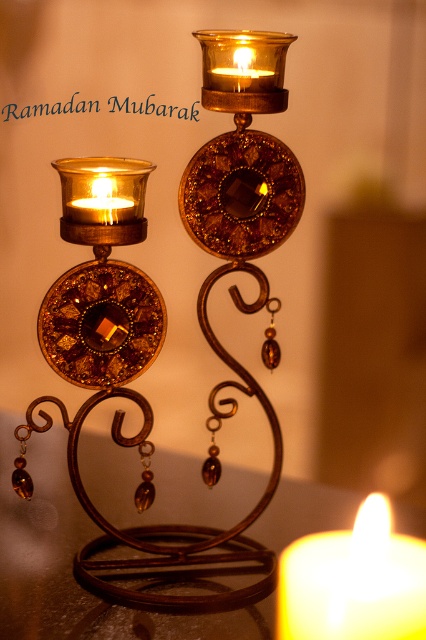
You are trying to place a decorative gold metallic candle holder at center on top of the metallic brown table at center. Based on the scene description, will the candle holder fit on the table without touching the ceiling?

The gold metallic candle holder at center has a greater height compared to metallic brown table at center. Since the candle holder is taller than the table, placing it on the table would cause the top of the candle holder to touch or exceed the table height, potentially making it unstable or too close to the ceiling. Therefore, it might not fit properly without adjustments.

You are arranging flowers for a centerpiece and need to place them between the matte gold candle at upper center and the matte gold candle at left. Which candle should you place the flowers closer to based on their positions?

The matte gold candle at upper center is to the right of the matte gold candle at left, so the flowers should be placed closer to the matte gold candle at left to maintain symmetry.

You are placing a small decorative item that is 6 inches wide on a table. You have the gold metallic candle holder at center and the metallic brown table at center in view. Can the item fit between them?

The gold metallic candle holder at center and the metallic brown table at center are 7.22 inches apart. Since the item is 6 inches wide, it can fit between them as the space is wider than the item.